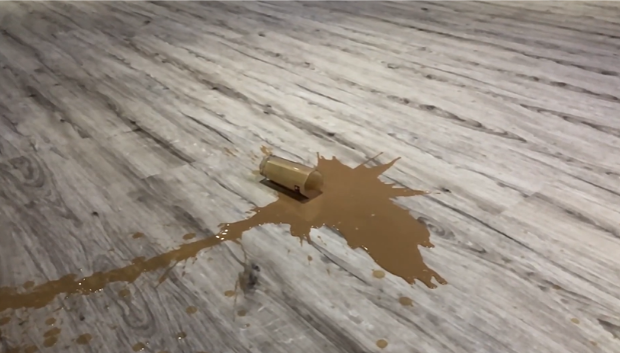
Find the location of a particular element. dark logo on cup is located at coordinates (294, 185).